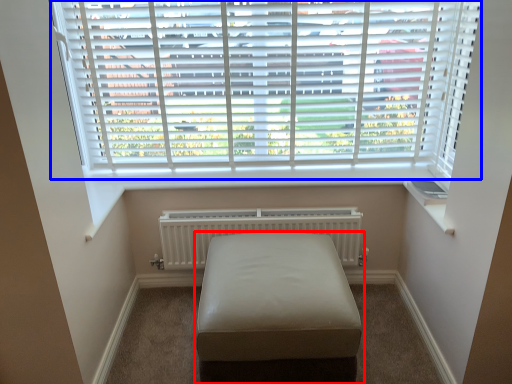
Question: Which object is closer to the camera taking this photo, furniture (highlighted by a red box) or window blind (highlighted by a blue box)?

Choices:
 (A) furniture
 (B) window blind

Answer: (A)